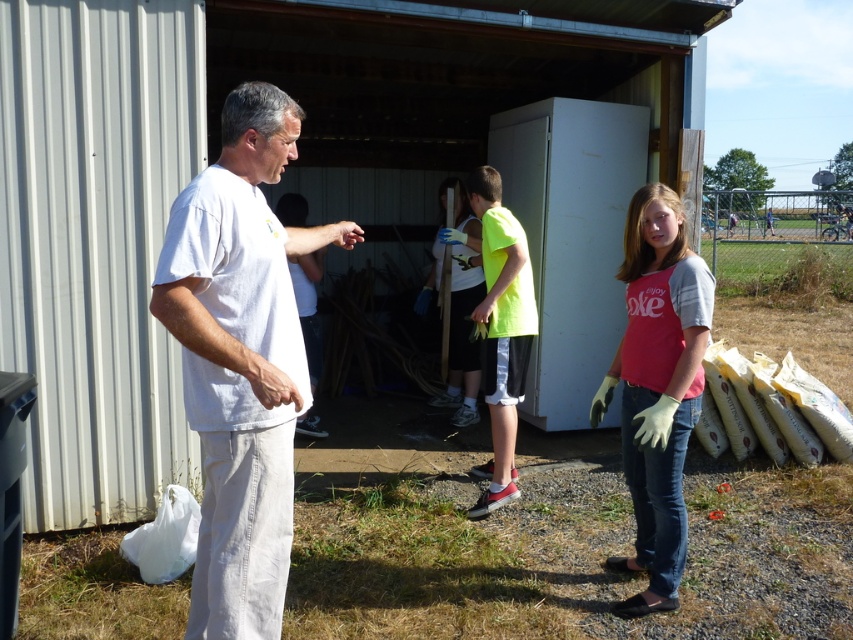
Who is positioned more to the left, white cotton shirt at left or matte pink t-shirt at center?

From the viewer's perspective, white cotton shirt at left appears more on the left side.

Who is higher up, white cotton shirt at left or matte pink t-shirt at center?

white cotton shirt at left is higher up.

At what (x,y) coordinates should I click in order to perform the action: click on white cotton shirt at left. Please return your answer as a coordinate pair (x, y). The height and width of the screenshot is (640, 853). Looking at the image, I should click on (241, 358).

The image size is (853, 640). Identify the location of white cotton shirt at left. (241, 358).

Can you confirm if matte pink t-shirt at center is positioned below neon green jersey at center?

Yes.

Can you confirm if matte pink t-shirt at center is positioned above neon green jersey at center?

Incorrect, matte pink t-shirt at center is not positioned above neon green jersey at center.

Is point (677, 198) positioned behind point (457, 182)?

No, it is not.

Image resolution: width=853 pixels, height=640 pixels. Identify the location of matte pink t-shirt at center. (657, 387).

Which is in front, point (210, 296) or point (431, 272)?

Positioned in front is point (210, 296).

Does white cotton shirt at left appear over neon green jersey at center?

No.

Is point (285, 486) positioned behind point (480, 298)?

No, it is not.

At what (x,y) coordinates should I click in order to perform the action: click on white cotton shirt at left. Please return your answer as a coordinate pair (x, y). Looking at the image, I should click on (241, 358).